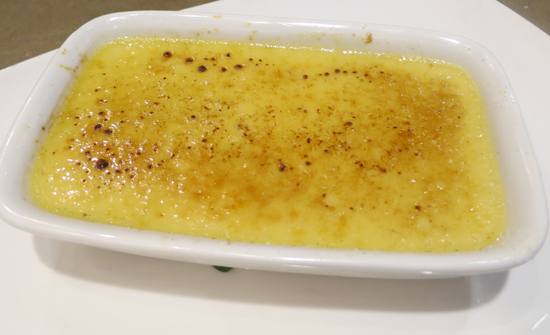
Locate an element on the screen. Image resolution: width=550 pixels, height=335 pixels. dish is located at coordinates (465, 48).